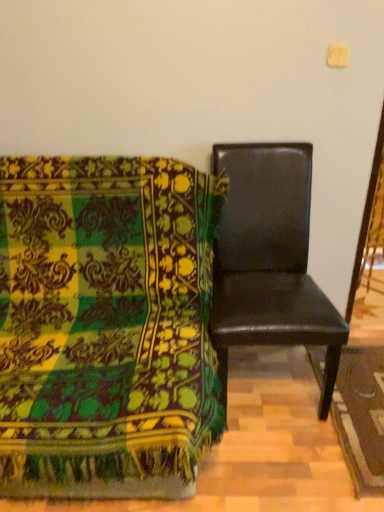
Question: Considering the relative positions of black leather chair at right, marked as the 1th chair in a left-to-right arrangement, and black leather chair at right, the 1th chair in the right-to-left sequence, in the image provided, is black leather chair at right, marked as the 1th chair in a left-to-right arrangement, to the left or to the right of black leather chair at right, the 1th chair in the right-to-left sequence,?

Choices:
 (A) right
 (B) left

Answer: (B)

Question: Looking at the image, does black leather chair at right, marked as the 1th chair in a left-to-right arrangement, seem bigger or smaller compared to black leather chair at right, the 2th chair when ordered from left to right?

Choices:
 (A) small
 (B) big

Answer: (B)

Question: From the image's perspective, is black leather chair at right, marked as the 1th chair in a left-to-right arrangement, located above or below black leather chair at right, the 1th chair in the right-to-left sequence?

Choices:
 (A) above
 (B) below

Answer: (B)

Question: Based on their sizes in the image, would you say black leather chair at right, the 2th chair when ordered from left to right, is bigger or smaller than black leather chair at right, marked as the 1th chair in a left-to-right arrangement?

Choices:
 (A) big
 (B) small

Answer: (B)

Question: Considering the positions of black leather chair at right, the 1th chair in the right-to-left sequence, and black leather chair at right, marked as the 2th chair in a right-to-left arrangement, in the image, is black leather chair at right, the 1th chair in the right-to-left sequence, taller or shorter than black leather chair at right, marked as the 2th chair in a right-to-left arrangement,?

Choices:
 (A) tall
 (B) short

Answer: (A)

Question: Would you say black leather chair at right, the 2th chair when ordered from left to right, is inside or outside black leather chair at right, marked as the 2th chair in a right-to-left arrangement?

Choices:
 (A) outside
 (B) inside

Answer: (A)

Question: Would you say black leather chair at right, the 1th chair in the right-to-left sequence, is to the left or to the right of black leather chair at right, marked as the 1th chair in a left-to-right arrangement, in the picture?

Choices:
 (A) right
 (B) left

Answer: (A)